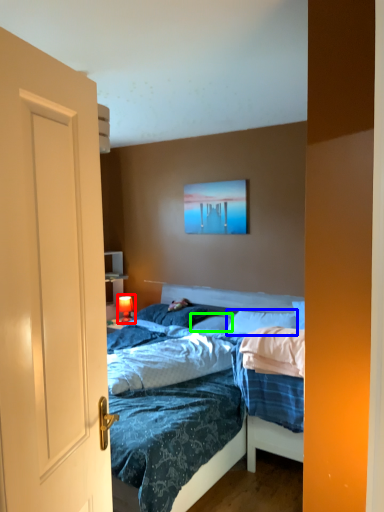
Question: Which object is positioned farthest from lamp (highlighted by a red box)? Select from pillow (highlighted by a blue box) and pillow (highlighted by a green box).

Choices:
 (A) pillow
 (B) pillow

Answer: (A)